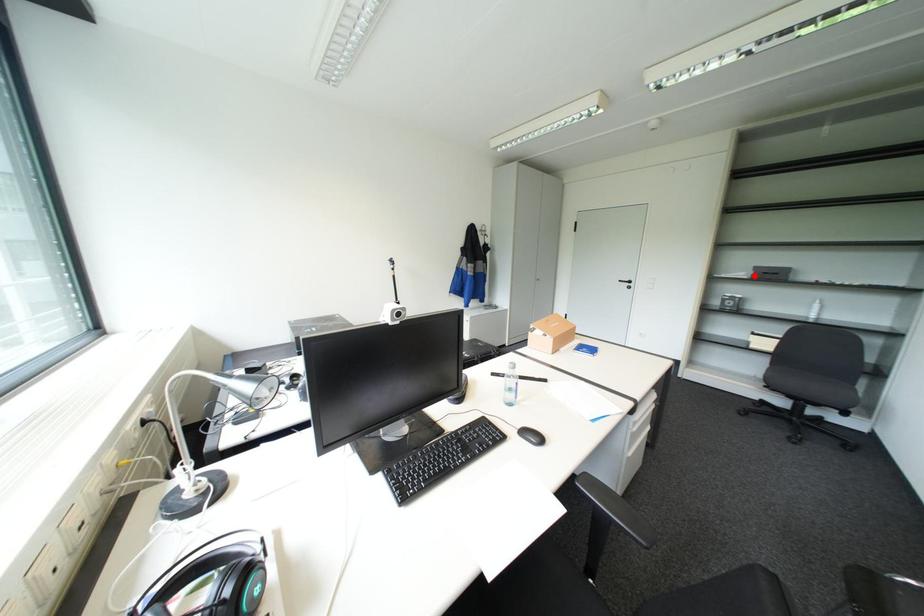
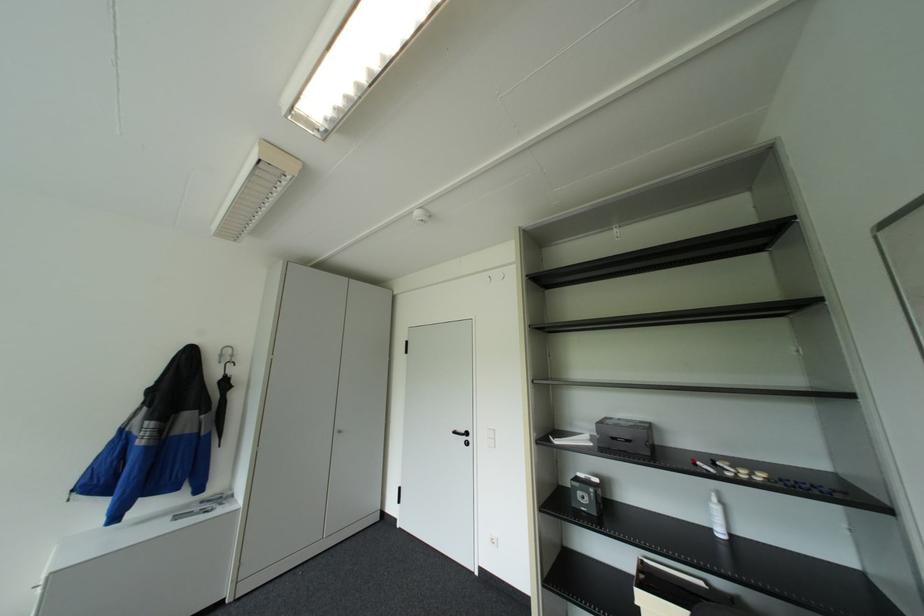
In the second image, find the point that corresponds to the highlighted location in the first image.

(600, 443)